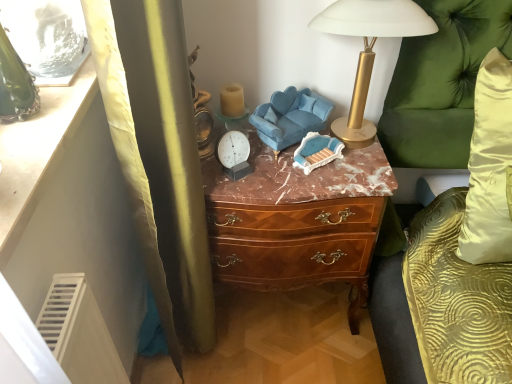
In order to click on free space in front of velvet blue swivel chair at center in this screenshot , I will do `click(294, 182)`.